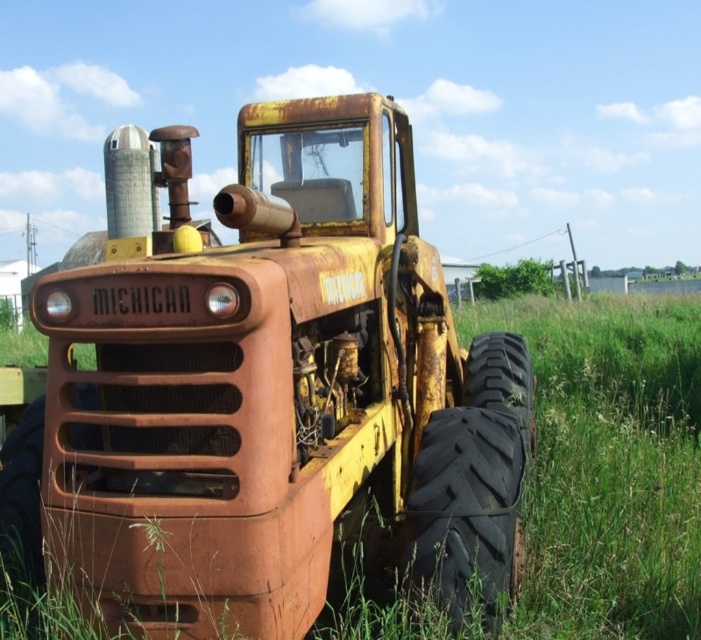
Can you confirm if black rubber tire at lower right is positioned above rusty rubber tire at lower right?

No.

Where is `black rubber tire at lower right`? The height and width of the screenshot is (640, 701). black rubber tire at lower right is located at coordinates tap(463, 508).

At what (x,y) coordinates should I click in order to perform the action: click on black rubber tire at lower right. Please return your answer as a coordinate pair (x, y). The image size is (701, 640). Looking at the image, I should click on tap(463, 508).

Based on the photo, can you confirm if rusty metal tractor at center is bigger than rusty rubber tire at lower right?

Yes.

Can you confirm if rusty metal tractor at center is wider than rusty rubber tire at lower right?

Yes, rusty metal tractor at center is wider than rusty rubber tire at lower right.

Is point (207, 632) positioned in front of point (498, 410)?

That is True.

Image resolution: width=701 pixels, height=640 pixels. I want to click on rusty metal tractor at center, so click(x=259, y=396).

Is rusty metal tractor at center above black rubber tire at lower right?

Yes.

Who is shorter, rusty metal tractor at center or black rubber tire at lower right?

With less height is black rubber tire at lower right.

Is point (402, 259) farther from viewer compared to point (408, 508)?

Yes, point (402, 259) is farther from viewer.

I want to click on rusty metal tractor at center, so click(259, 396).